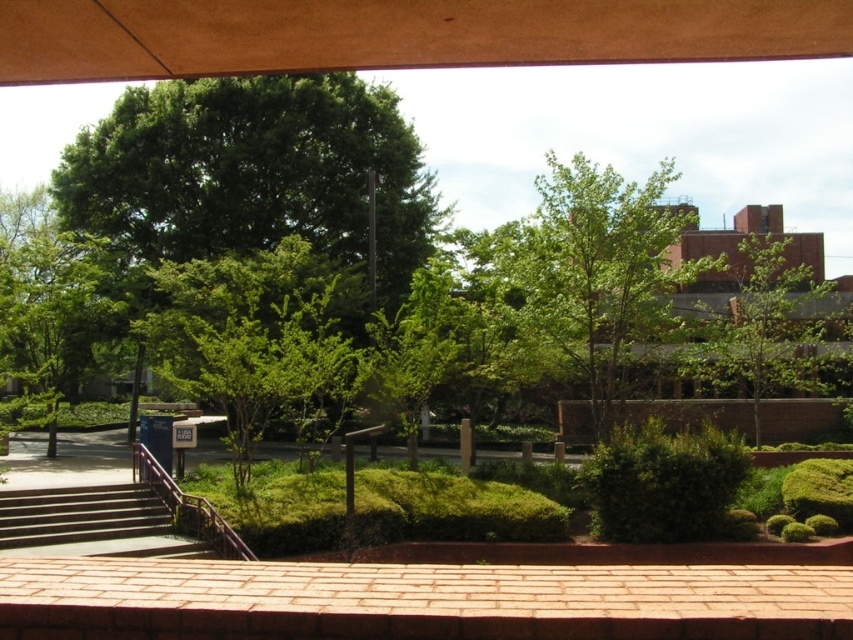
Which of these two, green leafy tree at center or green leafy bush at center, stands taller?

green leafy tree at center is taller.

Between green leafy tree at center and green leafy bush at center, which one appears on the left side from the viewer's perspective?

green leafy bush at center

Is point (779, 353) closer to camera compared to point (726, 464)?

No, (779, 353) is further to viewer.

Find the location of a particular element. green leafy tree at center is located at coordinates (759, 324).

Can you confirm if concrete stairs at lower left is thinner than purple metallic rail at lower left?

Incorrect, concrete stairs at lower left's width is not less than purple metallic rail at lower left's.

Can you confirm if concrete stairs at lower left is shorter than purple metallic rail at lower left?

Correct, concrete stairs at lower left is not as tall as purple metallic rail at lower left.

Does point (115, 484) lie in front of point (180, 516)?

No, it is behind (180, 516).

This screenshot has width=853, height=640. In order to click on concrete stairs at lower left in this screenshot , I will do (91, 524).

Between point (666, 172) and point (750, 282), which one is positioned behind?

Positioned behind is point (750, 282).

Is green leafy tree at upper center thinner than green leafy tree at center?

No.

Is point (523, 316) farther from viewer compared to point (743, 323)?

No, (523, 316) is closer to viewer.

Find the location of a particular element. The height and width of the screenshot is (640, 853). green leafy tree at upper center is located at coordinates (596, 268).